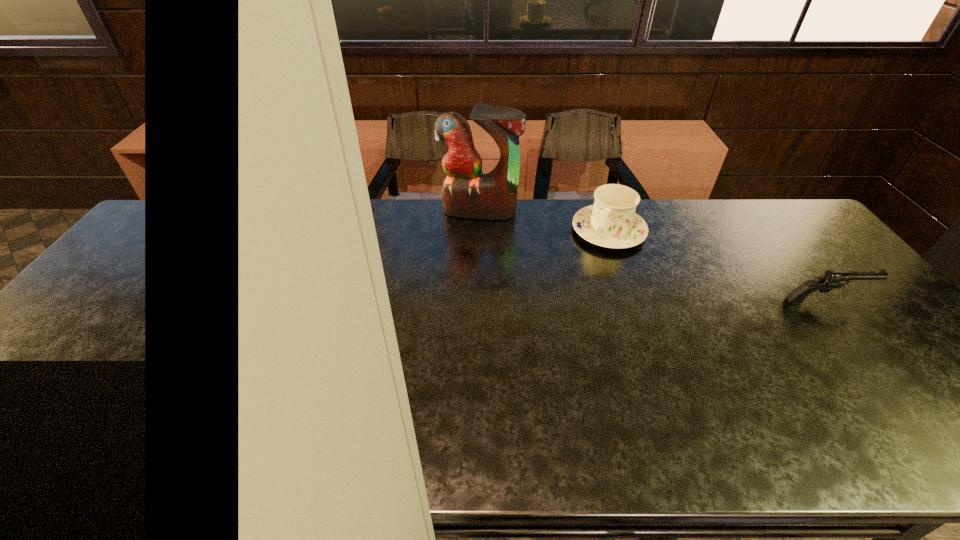
Locate an element on the screen. The image size is (960, 540). free space located at the face of the parrot is located at coordinates (461, 253).

Find the location of `vacant space located 0.310m at the face of the parrot`. vacant space located 0.310m at the face of the parrot is located at coordinates (450, 284).

Locate an element on the screen. chinaware positioned at the far edge is located at coordinates (611, 222).

You are a GUI agent. You are given a task and a screenshot of the screen. Output one action in this format:
    pyautogui.click(x=<x>, y=<y>)
    Task: Click on the parrot that is at the far edge
    
    Given the screenshot: What is the action you would take?
    pyautogui.click(x=466, y=192)

At what (x,y) coordinates should I click in order to perform the action: click on object present at the right edge. Please return your answer as a coordinate pair (x, y). Looking at the image, I should click on (831, 279).

Identify the location of free location at the far edge. (548, 199).

Where is `free space at the near edge of the desktop`? This screenshot has height=540, width=960. free space at the near edge of the desktop is located at coordinates (875, 386).

Locate an element on the screen. The height and width of the screenshot is (540, 960). vacant space at the left edge of the desktop is located at coordinates (138, 280).

Locate an element on the screen. free space at the right edge of the desktop is located at coordinates (859, 334).

I want to click on blank area at the far right corner, so click(x=784, y=230).